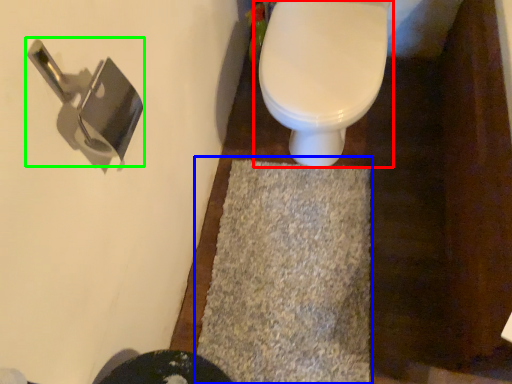
Question: Which object is positioned closest to toilet (highlighted by a red box)? Select from bath mat (highlighted by a blue box) and door handle (highlighted by a green box).

Choices:
 (A) bath mat
 (B) door handle

Answer: (A)